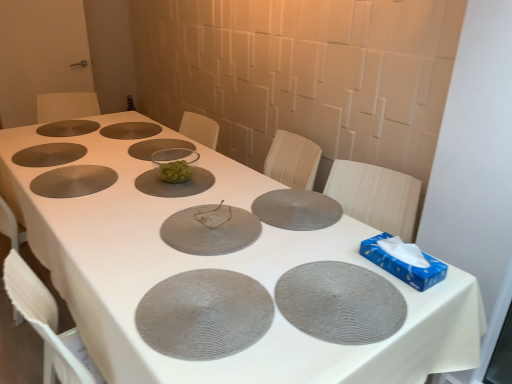
Where is `free space above matte gray placemat at left, which appears as the sixth glass plate when viewed from the back (from a real-world perspective)`? This screenshot has height=384, width=512. free space above matte gray placemat at left, which appears as the sixth glass plate when viewed from the back (from a real-world perspective) is located at coordinates (x=70, y=174).